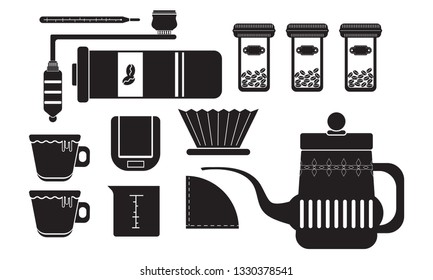
I want to click on coffee pot handle, so click(x=387, y=168), click(x=400, y=188), click(x=392, y=225).